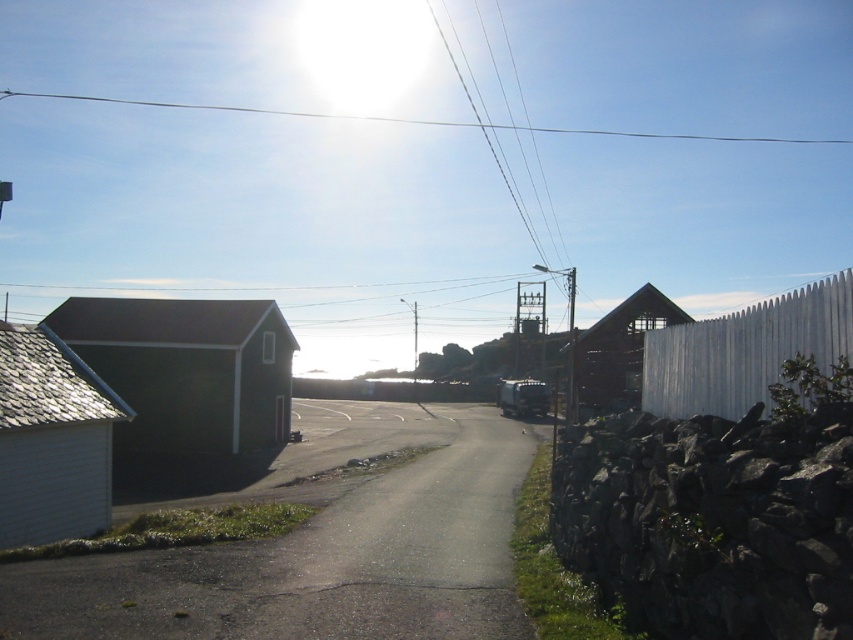
Which is below, white shiplap siding at left or clear wire at upper center?

white shiplap siding at left

Does white shiplap siding at left appear over clear wire at upper center?

Incorrect, white shiplap siding at left is not positioned above clear wire at upper center.

Where is `white shiplap siding at left`? white shiplap siding at left is located at coordinates (51, 440).

Does dark green wood hut at left lie in front of metallic blue truck at center?

Yes.

Which of these two, dark green wood hut at left or metallic blue truck at center, stands taller?

dark green wood hut at left

Identify the location of dark green wood hut at left. This screenshot has height=640, width=853. (187, 369).

Where is `dark green wood hut at left`? This screenshot has height=640, width=853. dark green wood hut at left is located at coordinates (187, 369).

The width and height of the screenshot is (853, 640). What do you see at coordinates (187, 369) in the screenshot? I see `dark green wood hut at left` at bounding box center [187, 369].

Does dark green wood hut at left have a smaller size compared to clear wire at upper center?

Correct, dark green wood hut at left occupies less space than clear wire at upper center.

Which is behind, point (165, 320) or point (512, 128)?

The point (512, 128) is more distant.

At what (x,y) coordinates should I click in order to perform the action: click on dark green wood hut at left. Please return your answer as a coordinate pair (x, y). Looking at the image, I should click on (187, 369).